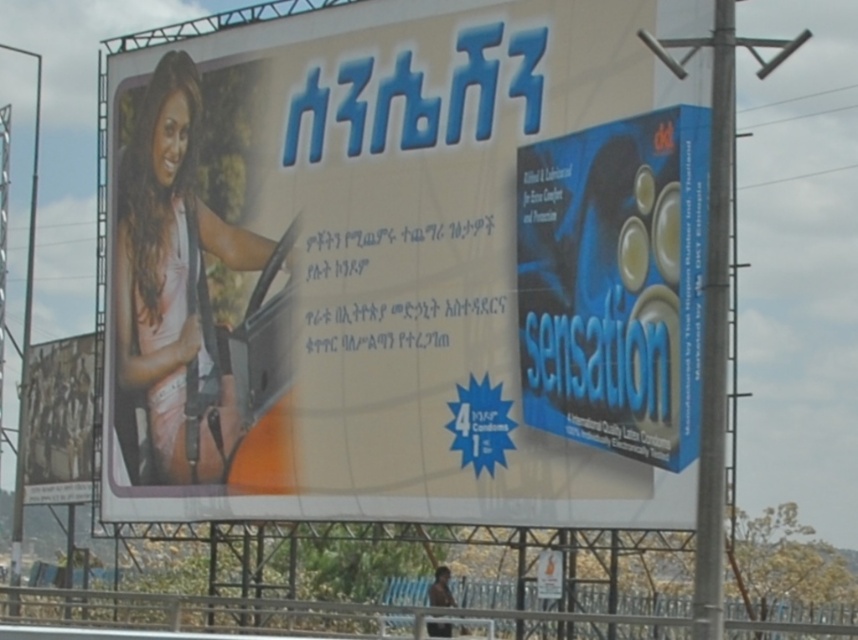
You are a graphic designer who needs to know the relative sizes of the matte white billboard at center and the blue cardboard sensation at right for a project. Which one is larger?

The matte white billboard at center is bigger than the blue cardboard sensation at right according to the description.